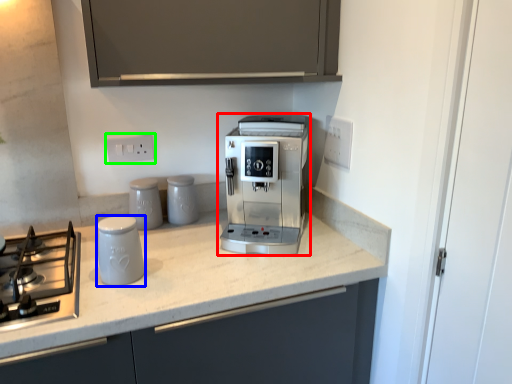
Question: Estimate the real-world distances between objects in this image. Which object is closer to coffee maker (highlighted by a red box), kitchen appliance (highlighted by a blue box) or electric outlet (highlighted by a green box)?

Choices:
 (A) kitchen appliance
 (B) electric outlet

Answer: (A)